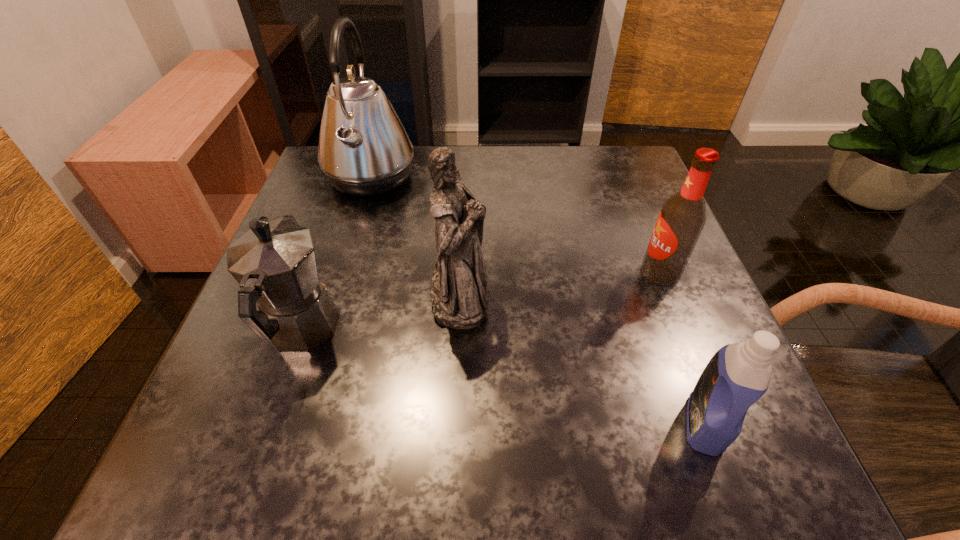
This screenshot has width=960, height=540. Identify the location of vacant position in the image that satisfies the following two spatial constraints: 1. from the spout of the farthest object; 2. on the right side of the beer bottle. (342, 272).

Where is `free space that satisfies the following two spatial constraints: 1. on the pouring side of the coffeepot; 2. on the left side of the beer bottle`? Image resolution: width=960 pixels, height=540 pixels. free space that satisfies the following two spatial constraints: 1. on the pouring side of the coffeepot; 2. on the left side of the beer bottle is located at coordinates (322, 272).